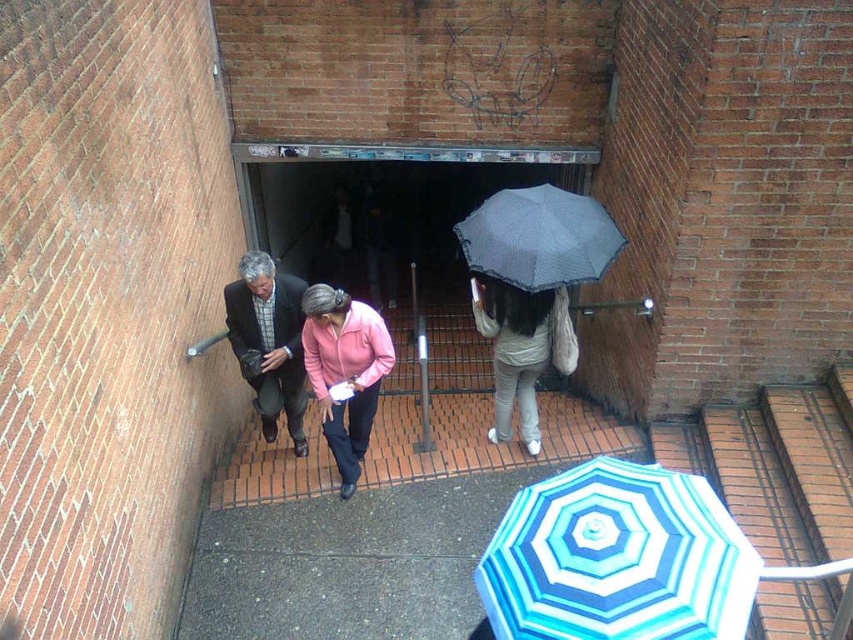
Question: Is blue striped fabric umbrella at lower right further to camera compared to dark gray knitted umbrella at center?

Choices:
 (A) no
 (B) yes

Answer: (A)

Question: Which point is farther from the camera taking this photo?

Choices:
 (A) (813, 538)
 (B) (293, 276)
 (C) (483, 225)

Answer: (B)

Question: Is blue striped fabric umbrella at lower right smaller than light gray fabric umbrella at center?

Choices:
 (A) yes
 (B) no

Answer: (A)

Question: Is dark gray knitted umbrella at center to the left of dark gray suit at center from the viewer's perspective?

Choices:
 (A) yes
 (B) no

Answer: (B)

Question: Estimate the real-world distances between objects in this image. Which object is closer to the blue striped umbrella at lower right?

Choices:
 (A) pink fabric jacket at center
 (B) light gray fabric umbrella at center
 (C) pink matte jacket at center

Answer: (B)

Question: Estimate the real-world distances between objects in this image. Which object is closer to the dark gray suit at center?

Choices:
 (A) light gray fabric umbrella at center
 (B) blue striped fabric umbrella at lower right
 (C) light pink fabric jacket at center
 (D) pink fabric jacket at center

Answer: (A)